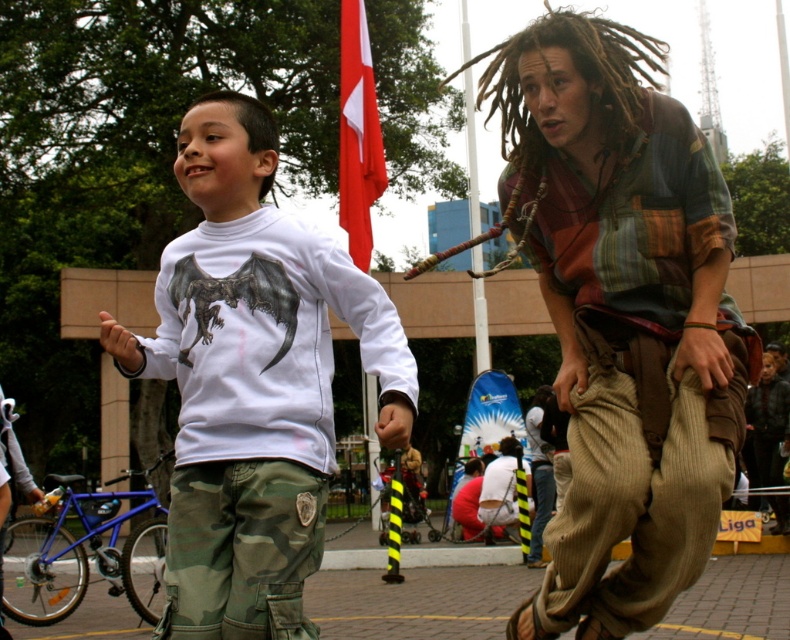
Question: Estimate the real-world distances between objects in this image. Which object is farther from the brown corduroy pants at center?

Choices:
 (A) white matte shirt at center
 (B) red fabric flag at upper center
 (C) green textured jacket at lower right
 (D) multicolored patchwork shirt at center

Answer: (A)

Question: Is red fabric flag at upper center above brown corduroy pants at center?

Choices:
 (A) yes
 (B) no

Answer: (A)

Question: Which object is positioned closest to the white matte shirt at center?

Choices:
 (A) red fabric flag at upper center
 (B) multicolored patchwork shirt at center
 (C) green textured jacket at lower right
 (D) brown corduroy pants at center

Answer: (B)

Question: Which point is farther to the camera?

Choices:
 (A) red fabric flag at upper center
 (B) multicolored patchwork shirt at center

Answer: (A)

Question: Is red fabric flag at upper center positioned in front of brown corduroy pants at center?

Choices:
 (A) no
 (B) yes

Answer: (A)

Question: Is multicolored patchwork shirt at center smaller than red fabric flag at upper center?

Choices:
 (A) no
 (B) yes

Answer: (A)